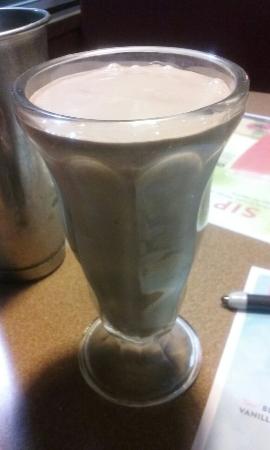
Find the location of a particular element. The image size is (270, 450). 1 glass is located at coordinates (112, 367).